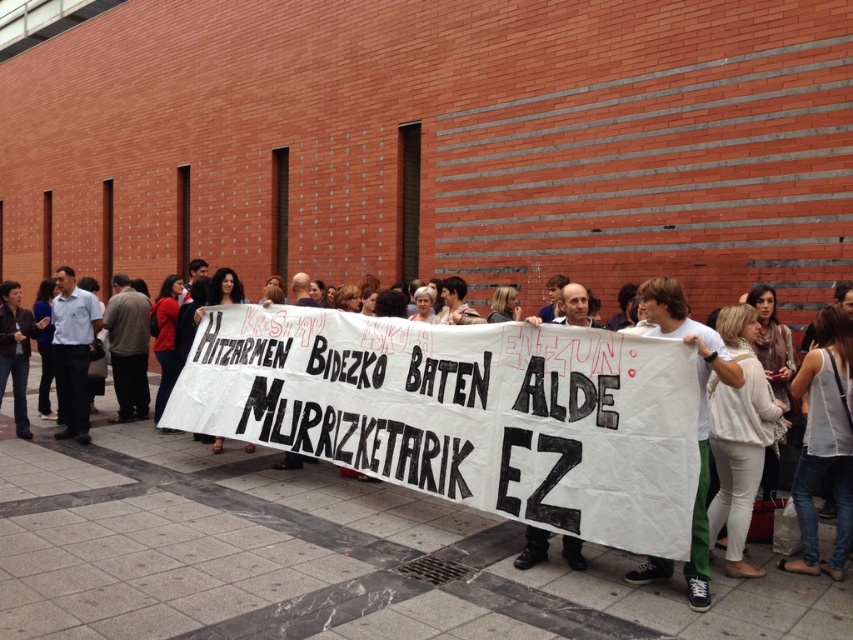
What is located at the point with coordinates (378, 477) in the image?

The point with coordinates (378, 477) corresponds to the white paper banner at center.

You are a photographer trying to capture the protest scene. You want to ensure that both the white paper banner at center and the white fabric banner at center are clearly visible in your photo. Which banner should you focus on to ensure it appears above the other in the image?

A: The white paper banner at center is positioned over the white fabric banner at center, so focusing on the white paper banner at center will ensure it appears above the other in the image.

In the scene shown: You are a protester holding a banner in front of the red brick wall. You notice two points marked in the scene. The first point is at coordinate point (463, 390) and the second at point (657, 572). Which point is closer to the wall?

Point (657, 572) is closer to the wall because it is in front of point (463, 390).